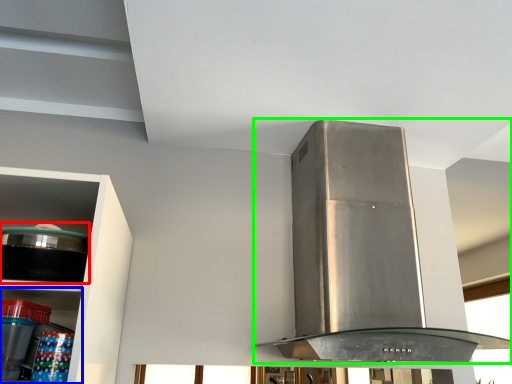
Question: Estimate the real-world distances between objects in this image. Which object is farther from appliance (highlighted by a red box), shelf (highlighted by a blue box) or home appliance (highlighted by a green box)?

Choices:
 (A) shelf
 (B) home appliance

Answer: (B)